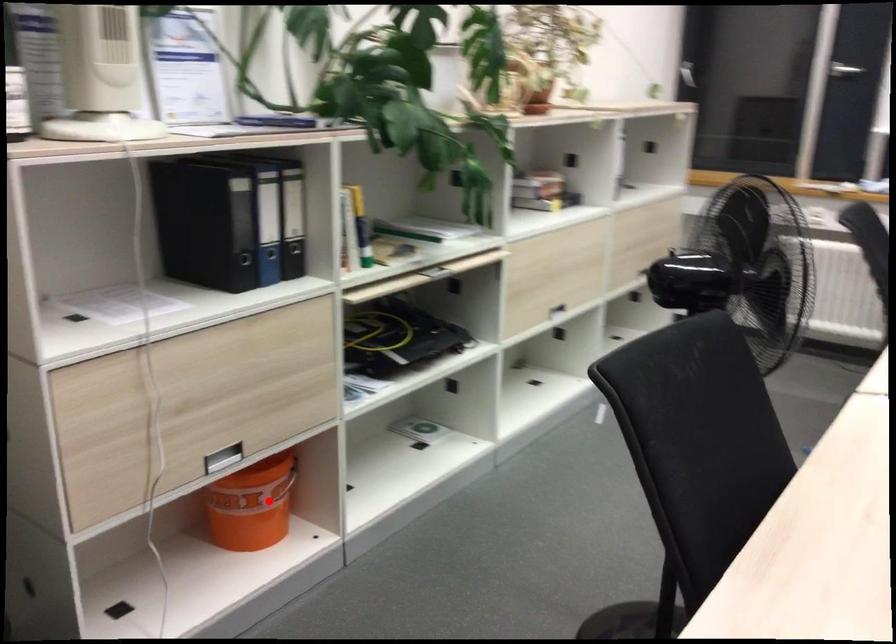
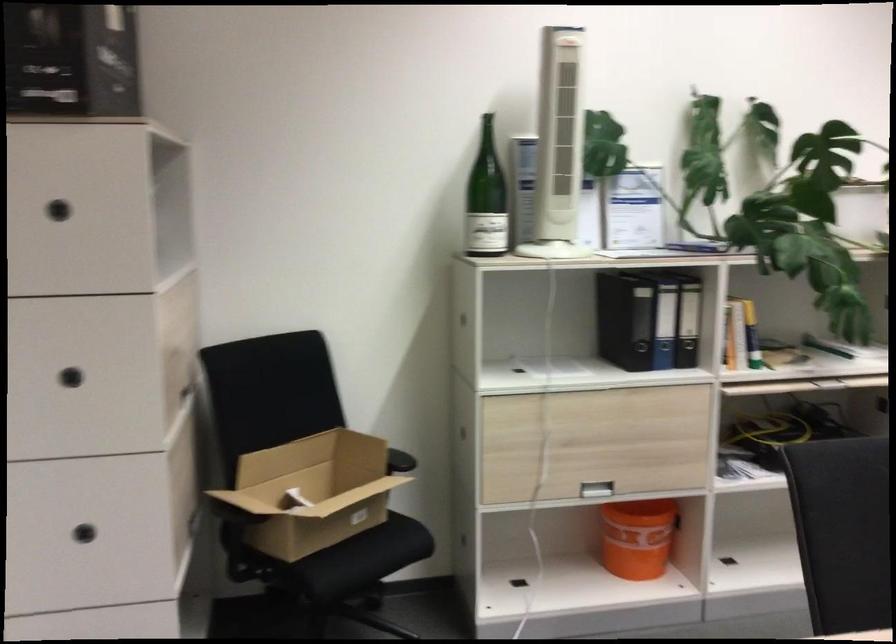
Question: I am providing you with two images of the same scene from different viewpoints. A red point is shown in image1. For the corresponding object point in image2, is it positioned nearer or farther from the camera?

Choices:
 (A) Nearer
 (B) Farther

Answer: (B)